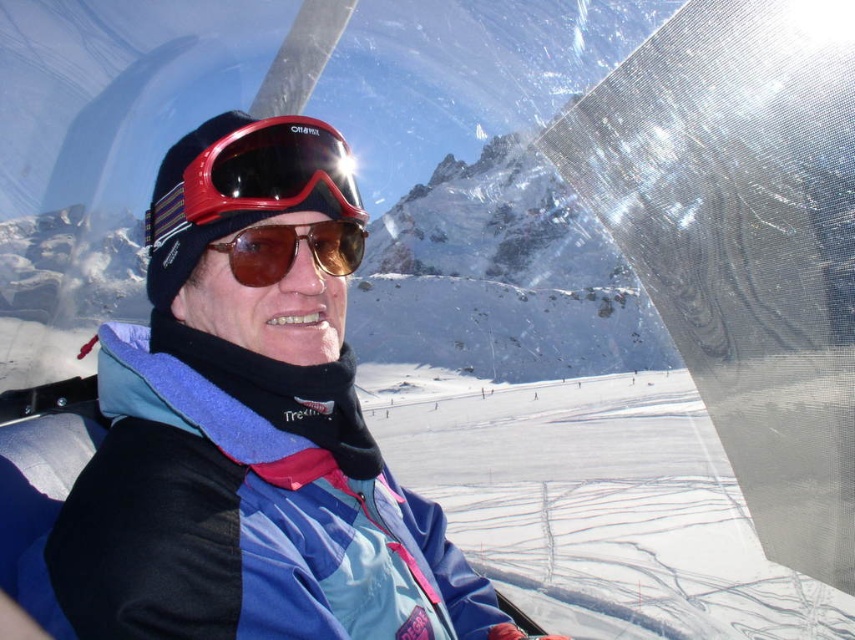
Who is lower down, matte black jacket at center or glossy red ski goggles at center?

matte black jacket at center

Image resolution: width=855 pixels, height=640 pixels. Describe the element at coordinates (249, 433) in the screenshot. I see `matte black jacket at center` at that location.

This screenshot has height=640, width=855. Identify the location of matte black jacket at center. (249, 433).

Does glossy red ski goggles at center have a greater width compared to brown reflective sunglasses at center?

Indeed, glossy red ski goggles at center has a greater width compared to brown reflective sunglasses at center.

Consider the image. Is glossy red ski goggles at center further to the viewer compared to brown reflective sunglasses at center?

No, it is not.

I want to click on glossy red ski goggles at center, so click(x=270, y=170).

Find the location of `glossy red ski goggles at center`. glossy red ski goggles at center is located at coordinates (270, 170).

Does matte black jacket at center have a greater width compared to brown reflective sunglasses at center?

Indeed, matte black jacket at center has a greater width compared to brown reflective sunglasses at center.

Who is more distant from viewer, (164,449) or (364,230)?

Positioned behind is point (364,230).

Where is `matte black jacket at center`? The height and width of the screenshot is (640, 855). matte black jacket at center is located at coordinates (249, 433).